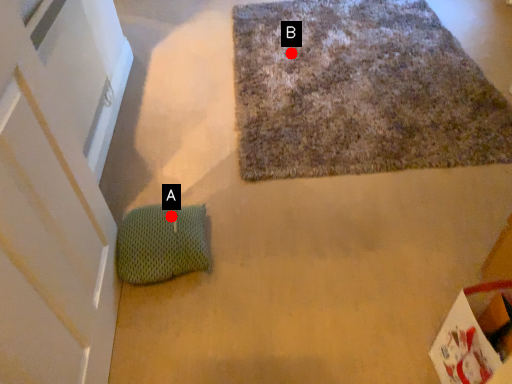
Question: Two points are circled on the image, labeled by A and B beside each circle. Among these points, which one is farthest from the camera?

Choices:
 (A) A is further
 (B) B is further

Answer: (B)